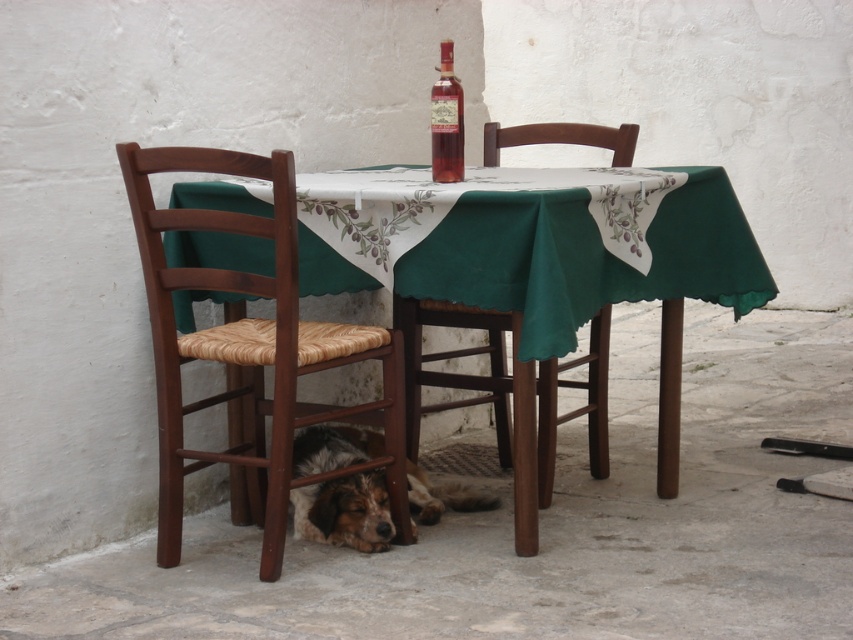
Question: From the image, what is the correct spatial relationship of green fabric table at center in relation to brown fur dog at lower center?

Choices:
 (A) left
 (B) right

Answer: (B)

Question: Is wooden woven seat chair at center in front of brown fur dog at lower center?

Choices:
 (A) no
 (B) yes

Answer: (B)

Question: Which object appears farthest from the camera in this image?

Choices:
 (A) green fabric table at center
 (B) brown fur dog at lower center
 (C) wooden woven seat chair at center
 (D) brown woven wood chair at lower left

Answer: (B)

Question: Is brown fur dog at lower center wider than matte glass bottle at center?

Choices:
 (A) no
 (B) yes

Answer: (B)

Question: Which point is farther to the camera?

Choices:
 (A) (440, 125)
 (B) (515, 349)

Answer: (A)

Question: Estimate the real-world distances between objects in this image. Which object is closer to the brown woven wood chair at lower left?

Choices:
 (A) green fabric table at center
 (B) brown fur dog at lower center
 (C) matte glass bottle at center
 (D) wooden woven seat chair at center

Answer: (B)